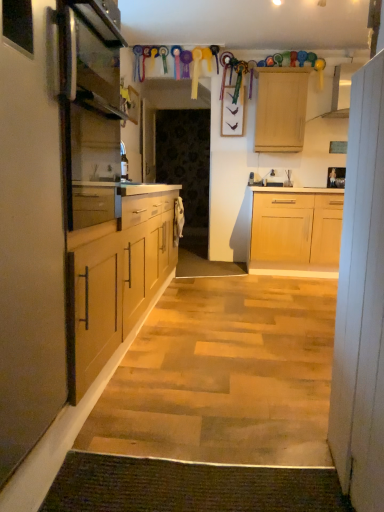
What do you see at coordinates (361, 302) in the screenshot? I see `white wood cabinet at right, the first cabinet in the right-to-left sequence` at bounding box center [361, 302].

This screenshot has height=512, width=384. What are the coordinates of `green textured mat at lower center` in the screenshot? It's located at (189, 487).

Find the location of `wooden cabinet at upper center`. wooden cabinet at upper center is located at coordinates (281, 109).

This screenshot has width=384, height=512. I want to click on wooden picture frame at upper right, so click(336, 177).

Consider the image. Considering the sizes of objects wooden cabinet at upper center and green textured mat at lower center in the image provided, who is bigger, wooden cabinet at upper center or green textured mat at lower center?

Bigger between the two is wooden cabinet at upper center.

From a real-world perspective, who is located lower, wooden cabinet at upper center or green textured mat at lower center?

green textured mat at lower center.

From the picture: Is wooden cabinet at upper center spatially inside green textured mat at lower center, or outside of it?

The correct answer is: outside.

What's the angular difference between wooden cabinet at upper center and green textured mat at lower center's facing directions?

Result: The facing directions of wooden cabinet at upper center and green textured mat at lower center are 180 degrees apart.

Could you tell me if white wood cabinet at right, the second cabinet viewed from the left, is facing white matte cabinet at left, acting as the first cabinet starting from the left?

No, white wood cabinet at right, the second cabinet viewed from the left, is not oriented towards white matte cabinet at left, acting as the first cabinet starting from the left.

Identify the location of cabinet below the white matte cabinet at left, acting as the first cabinet starting from the left (from the image's perspective). (361, 302).

Which of these two, white wood cabinet at right, the first cabinet in the right-to-left sequence, or white matte cabinet at left, which appears as the 2th cabinet when viewed from the right, is smaller?

With smaller size is white wood cabinet at right, the first cabinet in the right-to-left sequence.

Between white wood cabinet at right, the second cabinet viewed from the left, and white matte cabinet at left, acting as the first cabinet starting from the left, which one is positioned in front?

Positioned in front is white matte cabinet at left, acting as the first cabinet starting from the left.

Is wooden picture frame at upper right touching wooden cabinet at upper center?

No, wooden picture frame at upper right is not making contact with wooden cabinet at upper center.

The width and height of the screenshot is (384, 512). Identify the location of cabinetry above the wooden picture frame at upper right (from a real-world perspective). [x=281, y=109].

In the scene shown: What's the angular difference between wooden picture frame at upper right and wooden cabinet at upper center's facing directions?

The angular difference between wooden picture frame at upper right and wooden cabinet at upper center is 1.31 degrees.

Consider the image. Does wooden picture frame at upper right appear on the right side of wooden cabinet at upper center?

Yes, wooden picture frame at upper right is to the right of wooden cabinet at upper center.

Is satin silver oven at left oriented away from green textured mat at lower center?

No, green textured mat at lower center is not at the back of satin silver oven at left.

Considering the relative sizes of satin silver oven at left and green textured mat at lower center in the image provided, is satin silver oven at left thinner than green textured mat at lower center?

No.

Considering the points (74, 142) and (88, 460), which point is in front, point (74, 142) or point (88, 460)?

Point (74, 142)

Consider the image. Between satin silver oven at left and green textured mat at lower center, which one has more height?

satin silver oven at left is taller.

Does white wood cabinet at right, the first cabinet in the right-to-left sequence, have a greater width compared to wooden picture frame at upper right?

Yes.

Is white wood cabinet at right, the second cabinet viewed from the left, taller or shorter than wooden picture frame at upper right?

white wood cabinet at right, the second cabinet viewed from the left, is taller than wooden picture frame at upper right.

The image size is (384, 512). I want to click on cabinet that is the 1st object to the left of the wooden picture frame at upper right, starting at the anchor, so click(361, 302).

Is white wood cabinet at right, the first cabinet in the right-to-left sequence, to the left or to the right of wooden picture frame at upper right in the image?

From the image, it's evident that white wood cabinet at right, the first cabinet in the right-to-left sequence, is to the left of wooden picture frame at upper right.

Does point (134, 492) lie behind point (105, 51)?

No, it is not.

Who is bigger, green textured mat at lower center or satin silver oven at left?

satin silver oven at left is bigger.

Considering the sizes of green textured mat at lower center and satin silver oven at left in the image, is green textured mat at lower center wider or thinner than satin silver oven at left?

Clearly, green textured mat at lower center has less width compared to satin silver oven at left.

Is green textured mat at lower center inside the boundaries of satin silver oven at left, or outside?

green textured mat at lower center is not inside satin silver oven at left, it's outside.

Find the location of a particular element. The image size is (384, 512). cabinetry that appears above the white wood cabinet at right, the second cabinet viewed from the left (from a real-world perspective) is located at coordinates (281, 109).

Is wooden cabinet at upper center bigger than white wood cabinet at right, the second cabinet viewed from the left?

Correct, wooden cabinet at upper center is larger in size than white wood cabinet at right, the second cabinet viewed from the left.

Is the depth of wooden cabinet at upper center greater than that of white wood cabinet at right, the first cabinet in the right-to-left sequence?

Yes, wooden cabinet at upper center is further from the viewer.

Image resolution: width=384 pixels, height=512 pixels. I want to click on cabinetry above the green textured mat at lower center (from a real-world perspective), so tap(281, 109).

This screenshot has height=512, width=384. In order to click on cabinet above the white wood cabinet at right, the first cabinet in the right-to-left sequence (from the image's perspective) in this screenshot , I will do 30,238.

Considering their positions, is wooden cabinet at upper center positioned closer to satin silver oven at left than green textured mat at lower center?

The object closer to satin silver oven at left is wooden cabinet at upper center.

When comparing their distances from white matte cabinet at left, which appears as the 2th cabinet when viewed from the right, does green textured mat at lower center or wooden picture frame at upper right seem further?

wooden picture frame at upper right.

Looking at the image, which one is located further to satin silver oven at left, white wood cabinet at right, the first cabinet in the right-to-left sequence, or white matte cabinet at left, acting as the first cabinet starting from the left?

white wood cabinet at right, the first cabinet in the right-to-left sequence, is positioned further to the anchor satin silver oven at left.

Estimate the real-world distances between objects in this image. Which object is closer to white wood cabinet at right, the second cabinet viewed from the left, green textured mat at lower center or satin silver oven at left?

The object closer to white wood cabinet at right, the second cabinet viewed from the left, is green textured mat at lower center.

Looking at the image, which one is located further to wooden picture frame at upper right, green textured mat at lower center or satin silver oven at left?

green textured mat at lower center is further to wooden picture frame at upper right.

Looking at the image, which one is located closer to wooden cabinet at upper center, green textured mat at lower center or wooden picture frame at upper right?

wooden picture frame at upper right lies closer to wooden cabinet at upper center than the other object.

When comparing their distances from white matte cabinet at left, which appears as the 2th cabinet when viewed from the right, does wooden picture frame at upper right or green textured mat at lower center seem further?

wooden picture frame at upper right is positioned further to the anchor white matte cabinet at left, which appears as the 2th cabinet when viewed from the right.

Based on the photo, when comparing their distances from wooden cabinet at upper center, does satin silver oven at left or white wood cabinet at right, the second cabinet viewed from the left, seem closer?

satin silver oven at left is positioned closer to the anchor wooden cabinet at upper center.

Find the location of a particular element. The image size is (384, 512). appliance located between white matte cabinet at left, which appears as the 2th cabinet when viewed from the right, and wooden picture frame at upper right in the depth direction is located at coordinates (89, 105).

Identify the location of doormat between white wood cabinet at right, the second cabinet viewed from the left, and wooden cabinet at upper center in the front-back direction. (189, 487).

Image resolution: width=384 pixels, height=512 pixels. Identify the location of cabinetry between satin silver oven at left and wooden picture frame at upper right along the z-axis. (281, 109).

Identify the location of cabinetry between green textured mat at lower center and wooden picture frame at upper right in the front-back direction. (281, 109).